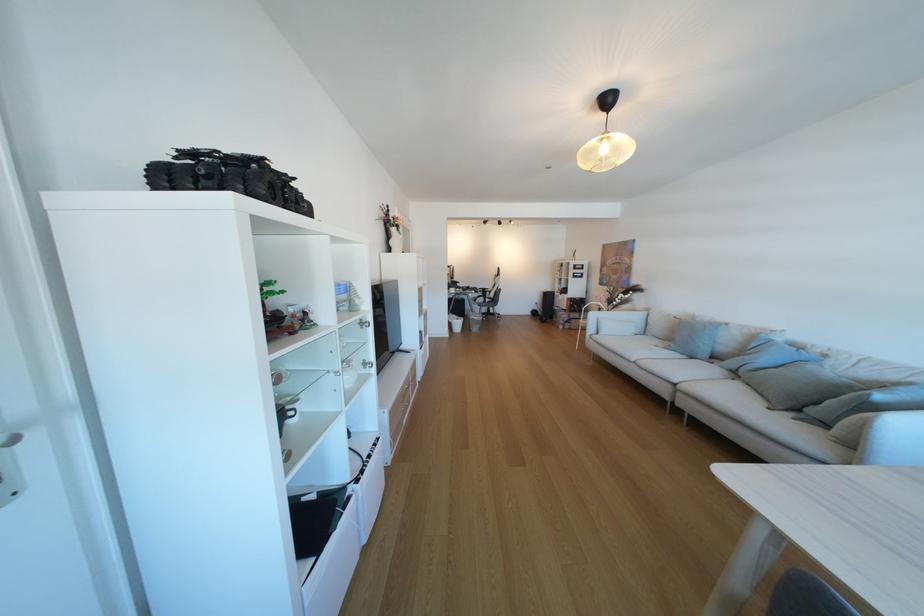
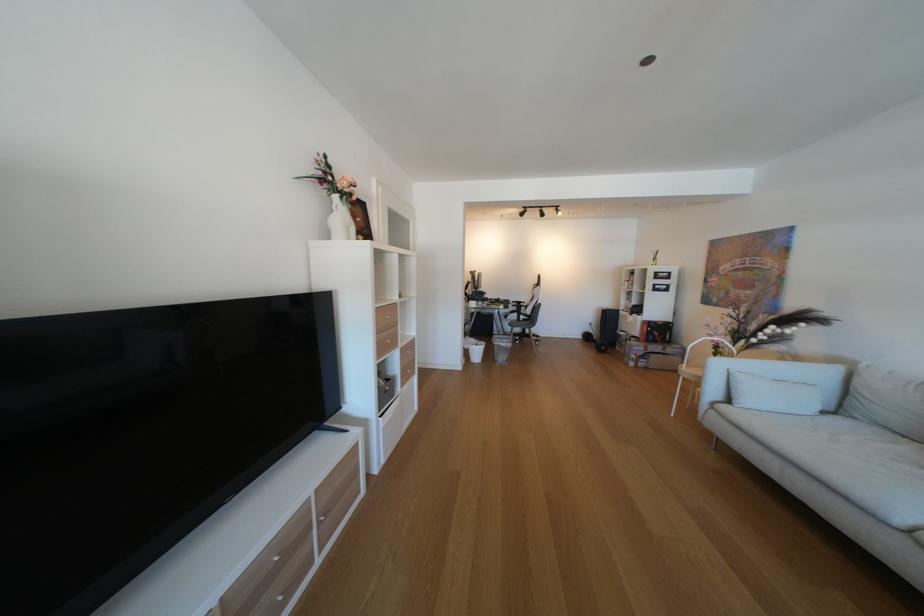
The point at (654,315) is marked in the first image. Where is the corresponding point in the second image?

(845, 371)